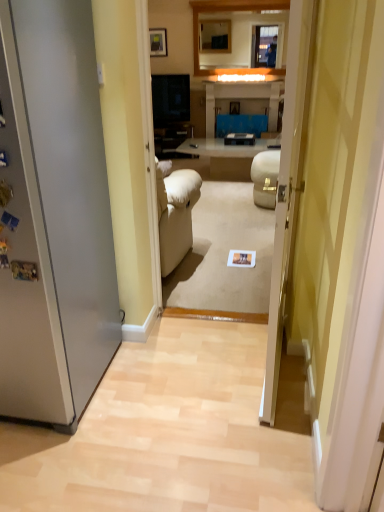
Question: In the image, is matte black picture frame at upper center positioned in front of or behind transparent glass door at center?

Choices:
 (A) front
 (B) behind

Answer: (B)

Question: Is matte black picture frame at upper center taller or shorter than transparent glass door at center?

Choices:
 (A) short
 (B) tall

Answer: (A)

Question: Is matte black picture frame at upper center bigger or smaller than transparent glass door at center?

Choices:
 (A) big
 (B) small

Answer: (B)

Question: From the image's perspective, is transparent glass door at center positioned above or below matte black picture frame at upper center?

Choices:
 (A) below
 (B) above

Answer: (A)

Question: Is transparent glass door at center inside or outside of matte black picture frame at upper center?

Choices:
 (A) inside
 (B) outside

Answer: (B)

Question: Is transparent glass door at center taller or shorter than matte black picture frame at upper center?

Choices:
 (A) short
 (B) tall

Answer: (B)

Question: Considering the positions of transparent glass door at center and matte black picture frame at upper center in the image, is transparent glass door at center bigger or smaller than matte black picture frame at upper center?

Choices:
 (A) small
 (B) big

Answer: (B)